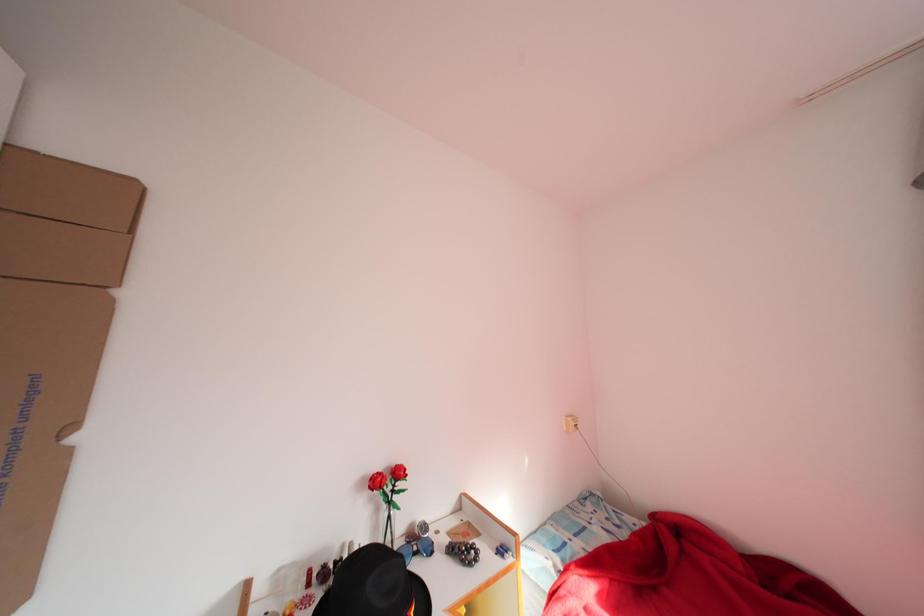
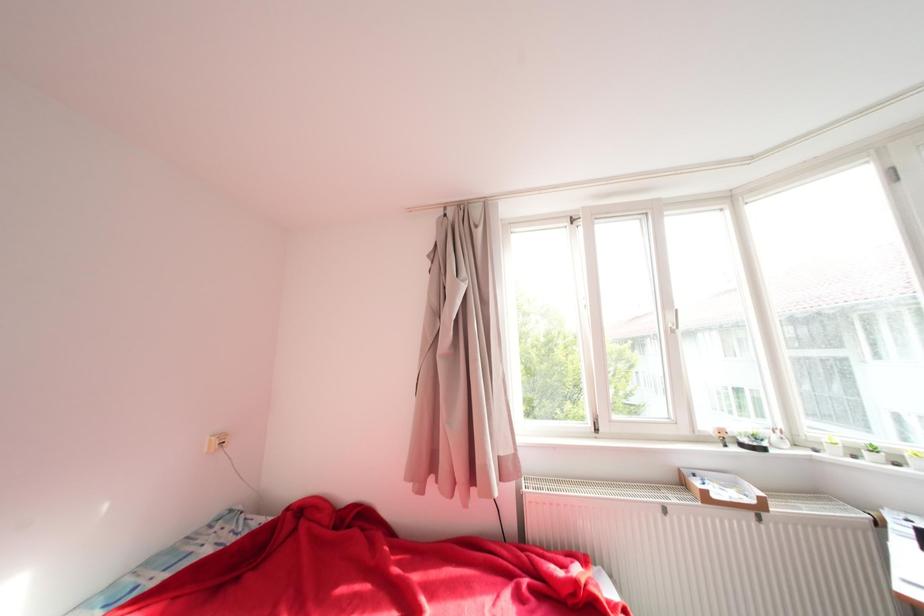
Question: The camera is either moving clockwise (left) or counter-clockwise (right) around the object. The first image is from the beginning of the video and the second image is from the end. Is the camera moving left or right when shooting the video?

Choices:
 (A) Left
 (B) Right

Answer: (A)